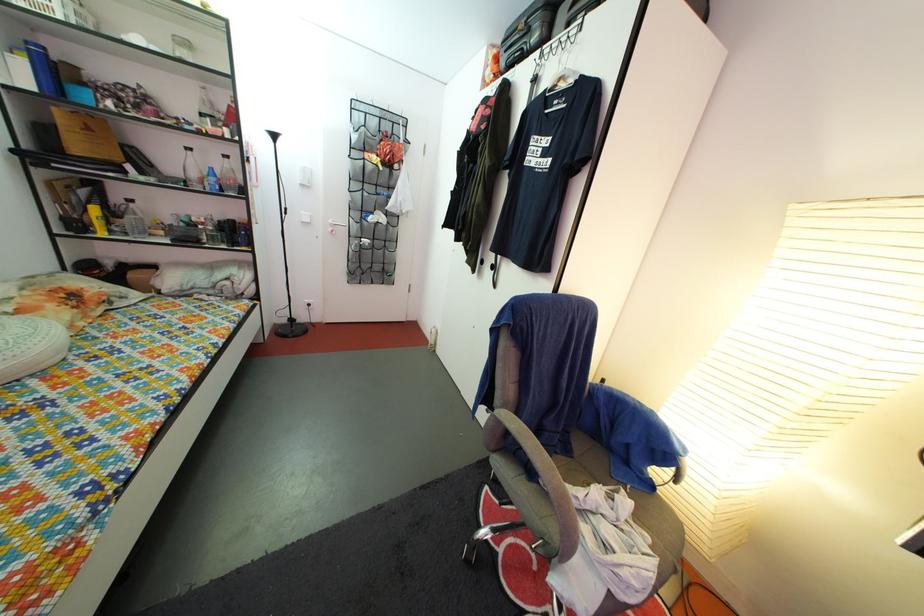
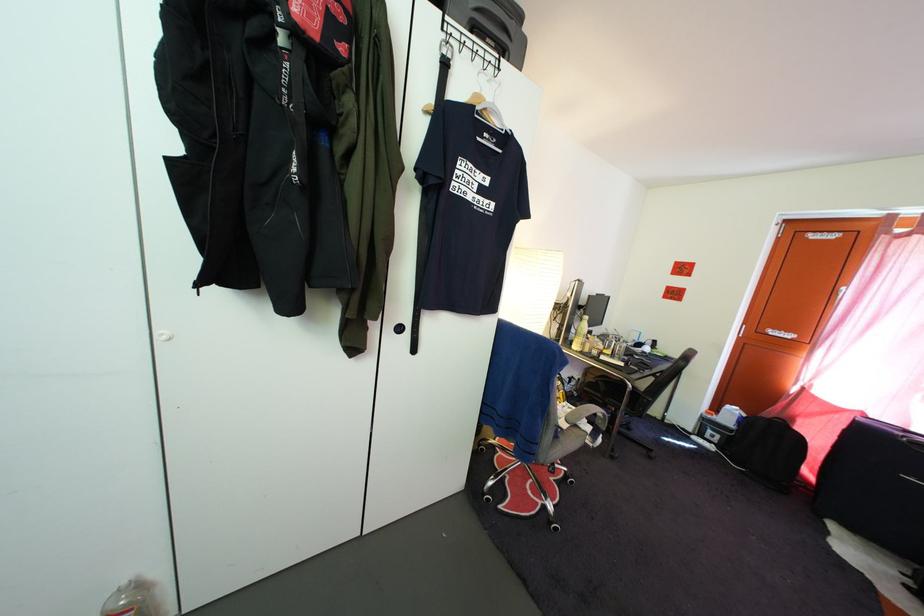
Where in the second image is the point corresponding to the point at 568,87 from the first image?

(494, 118)